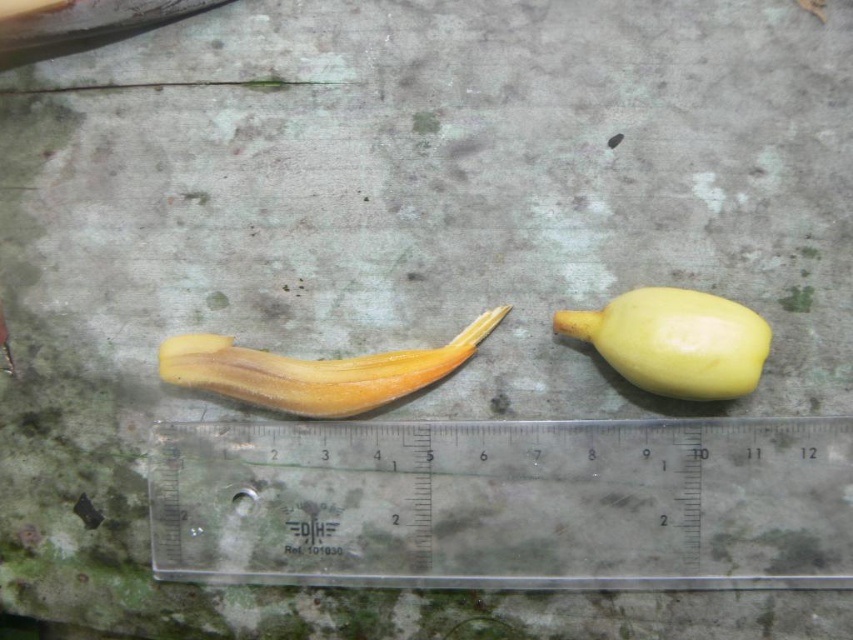
You are standing in front of two objects on a weathered surface. The first object is a banana peel lookalike with a pointed tip, and the second is marked as point (701, 349). Which object is closer to you?

The point (701, 349) is 4.27 feet from the viewer, so it is closer than the banana peel lookalike since the banana peel lookalike is not mentioned in the objects description.